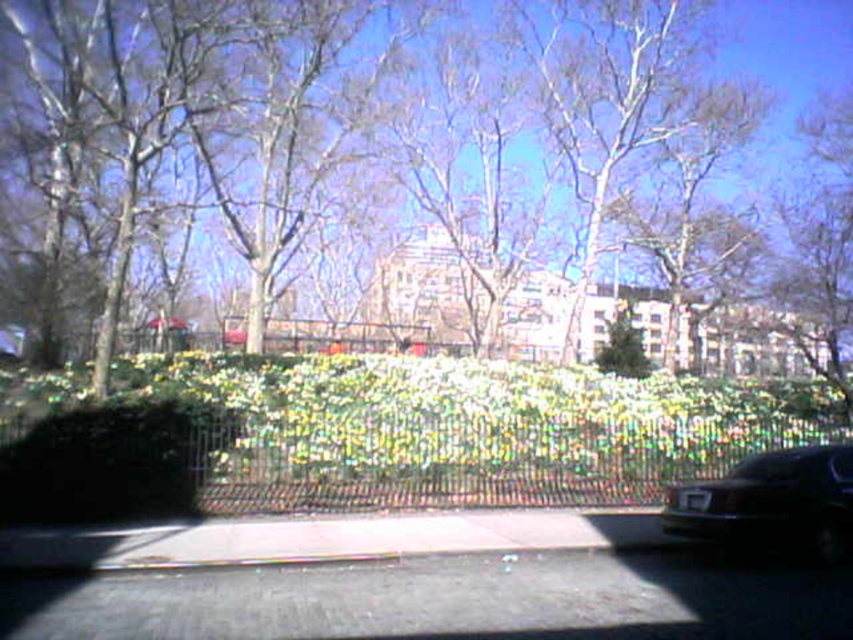
You are a delivery robot that needs to deliver a package to a drop point located exactly at the green leafy bush at center. Your current position is at the black metal fence at center. The robot has a maximum delivery range of 10 meters. Can you reach the drop point without exceeding your range?

The black metal fence at center is 8.79 meters away from green leafy bush at center. Since the robot has a maximum delivery range of 10 meters, it can reach the drop point without exceeding its range because 8.79 meters is less than 10 meters.

You are a gardener planning to plant a new tree in the park. You notice the smooth bark tree at center and the green leafy bush at center. Which one has a larger width according to the scene?

The smooth bark tree at center might be wider than green leafy bush at center.